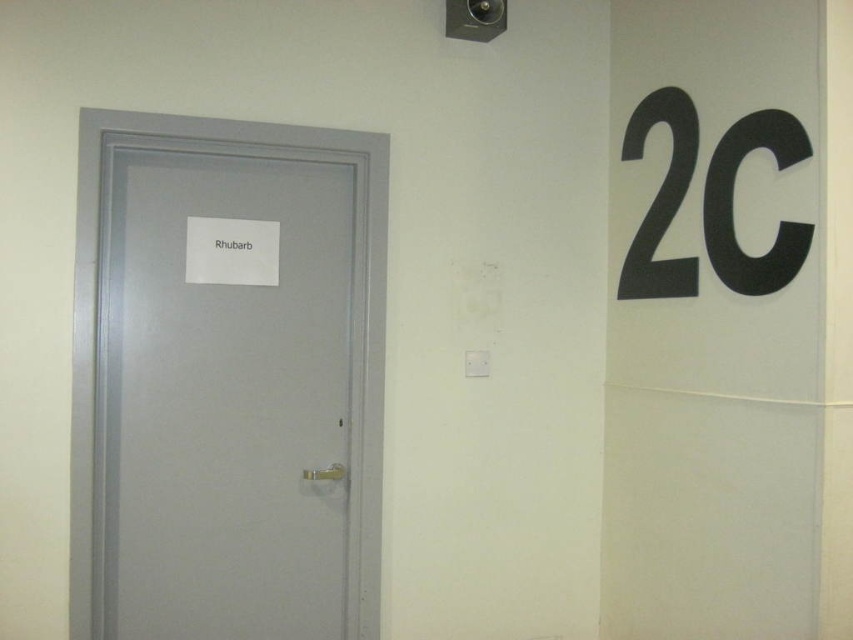
Does point (337, 248) lie in front of point (686, 125)?

No, it is not.

Who is lower down, matte gray door at left or black plastic number at upper right?

matte gray door at left is lower down.

Is point (71, 577) positioned before point (650, 228)?

Yes, point (71, 577) is closer to viewer.

The width and height of the screenshot is (853, 640). I want to click on matte gray door at left, so click(225, 380).